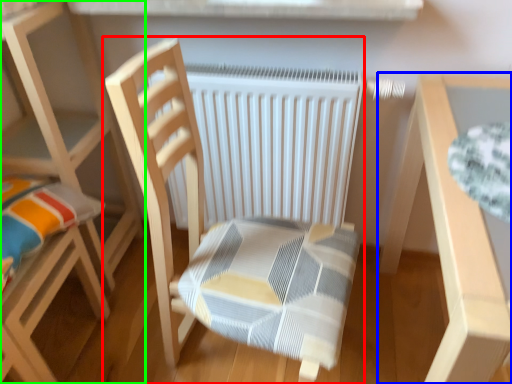
Question: Estimate the real-world distances between objects in this image. Which object is farther from chair (highlighted by a red box), table (highlighted by a blue box) or chair (highlighted by a green box)?

Choices:
 (A) table
 (B) chair

Answer: (B)